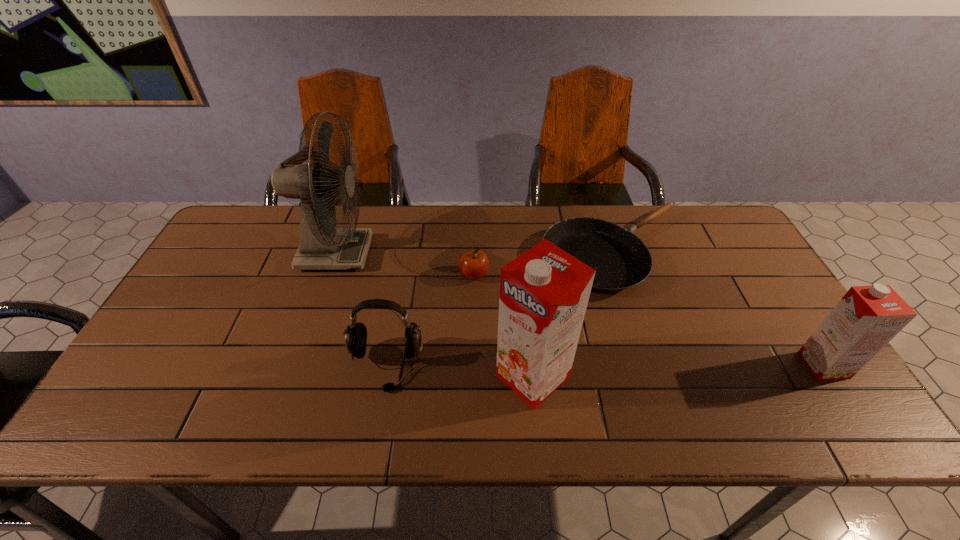
This screenshot has width=960, height=540. Find the location of `free space located 0.270m on the left of the left carton`. free space located 0.270m on the left of the left carton is located at coordinates (382, 376).

Where is `vacant space situated on the back of the rightmost object`? The image size is (960, 540). vacant space situated on the back of the rightmost object is located at coordinates (798, 325).

This screenshot has height=540, width=960. Find the location of `free space located 0.120m on the front of the frying pan`. free space located 0.120m on the front of the frying pan is located at coordinates (643, 336).

At what (x,y) coordinates should I click in order to perform the action: click on free location located 0.330m on the left of the third object from left to right. Please return your answer as a coordinate pair (x, y). The width and height of the screenshot is (960, 540). Looking at the image, I should click on (346, 275).

This screenshot has width=960, height=540. I want to click on vacant space positioned on the front-facing side of the fan, so click(x=419, y=254).

The image size is (960, 540). Find the location of `frying pan positioned at the far edge`. frying pan positioned at the far edge is located at coordinates [x=621, y=260].

Find the location of `fan present at the far edge`. fan present at the far edge is located at coordinates (322, 246).

Where is `headset present at the near edge`? This screenshot has width=960, height=540. headset present at the near edge is located at coordinates (356, 334).

Where is `object that is at the right edge`? Image resolution: width=960 pixels, height=540 pixels. object that is at the right edge is located at coordinates (867, 318).

Image resolution: width=960 pixels, height=540 pixels. What are the coordinates of `object located in the near right corner section of the desktop` in the screenshot? It's located at (867, 318).